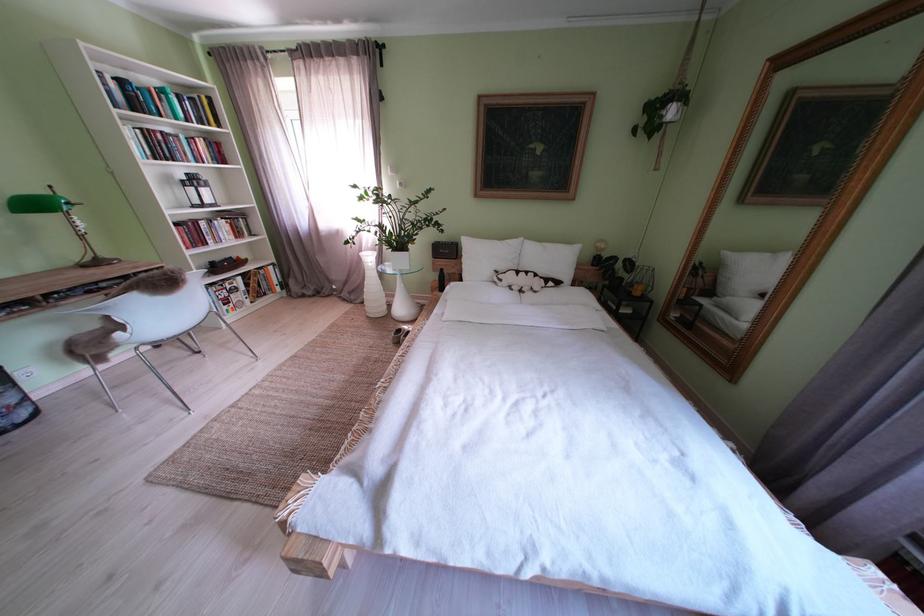
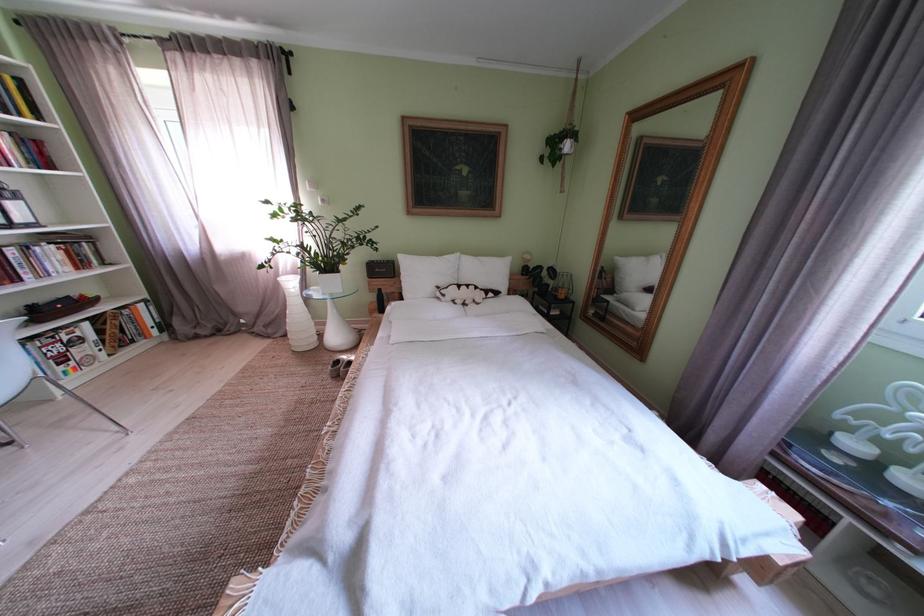
Question: I am providing you with two images of the same scene from different viewpoints. After the viewpoint changes to image2, which objects are now occluded?

Choices:
 (A) black speaker
 (B) bedside lamp
 (C) white textured vase
 (D) none of these

Answer: (D)